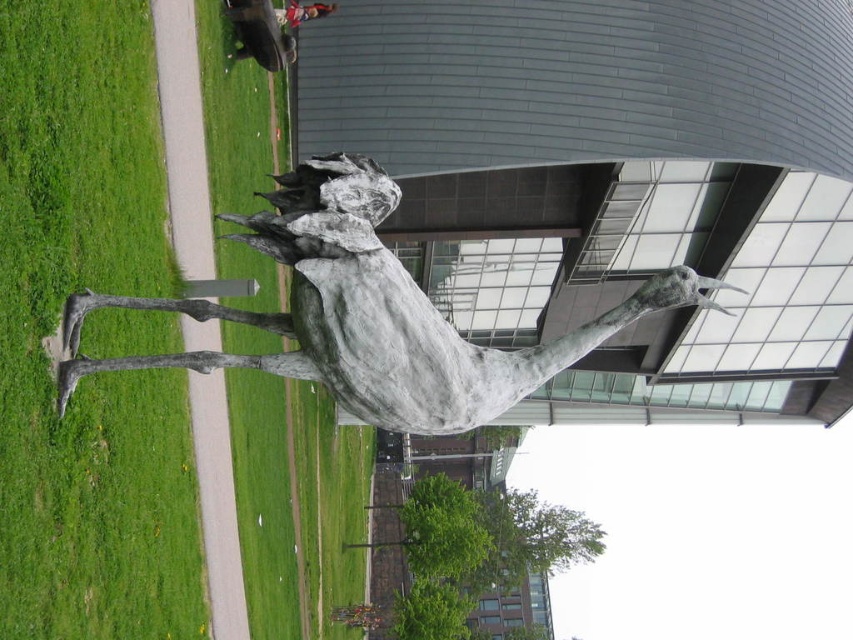
Does point (65, 568) come closer to viewer compared to point (76, 342)?

Yes, it is.

Which is behind, point (6, 442) or point (392, 400)?

The point (392, 400) is more distant.

In order to click on green grass at left in this screenshot , I will do [x=57, y=323].

Can you confirm if green grass at left is bigger than red shirt at upper center?

Correct, green grass at left is larger in size than red shirt at upper center.

Is point (12, 45) more distant than point (323, 12)?

That is False.

What do you see at coordinates (57, 323) in the screenshot?
I see `green grass at left` at bounding box center [57, 323].

Locate an element on the screen. This screenshot has height=640, width=853. green grass at left is located at coordinates (57, 323).

Can you confirm if bronze horse at center is positioned below red shirt at upper center?

Correct, bronze horse at center is located below red shirt at upper center.

Which is above, bronze horse at center or red shirt at upper center?

Positioned higher is red shirt at upper center.

Identify the location of bronze horse at center. Image resolution: width=853 pixels, height=640 pixels. (369, 314).